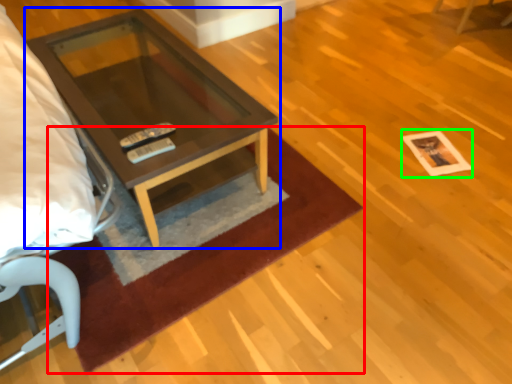
Question: Which is nearer to the mat (highlighted by a red box)? coffee table (highlighted by a blue box) or square (highlighted by a green box).

Choices:
 (A) coffee table
 (B) square

Answer: (A)